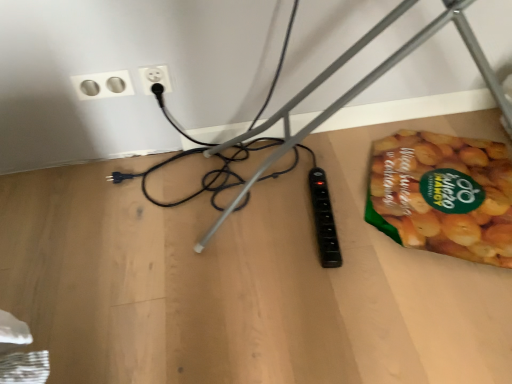
Identify the location of free spot below black plastic wire at lower right (from a real-world perspective). This screenshot has height=384, width=512. (272, 212).